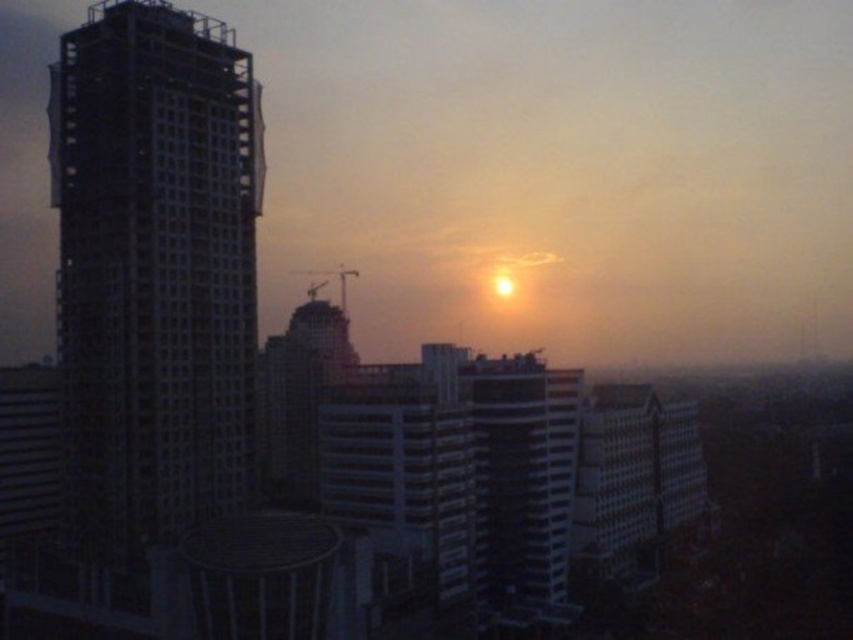
Question: Is metallic grid tower at left bigger than smooth glass building at center?

Choices:
 (A) yes
 (B) no

Answer: (A)

Question: Is the position of metallic grid tower at left more distant than that of smooth glass building at center?

Choices:
 (A) no
 (B) yes

Answer: (A)

Question: Does metallic grid tower at left appear on the left side of smooth glass building at center?

Choices:
 (A) no
 (B) yes

Answer: (B)

Question: Which of the following is the closest to the observer?

Choices:
 (A) (67, 429)
 (B) (531, 584)

Answer: (A)